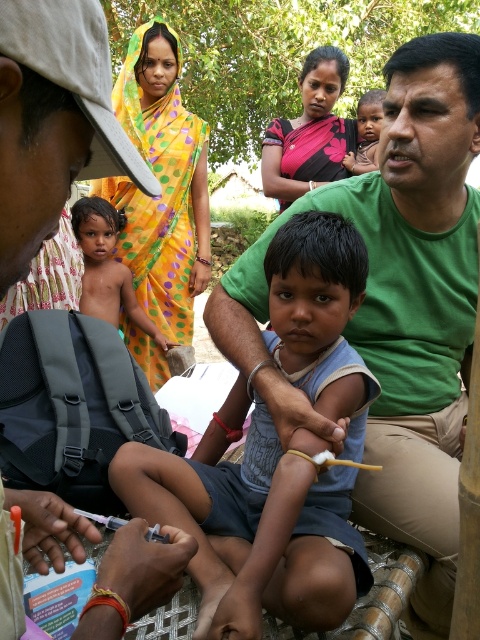
You are a healthcare worker observing a vaccination scene. You notice the light blue fabric shirt at center and the matte skin child at center. Which object is wider?

The light blue fabric shirt at center is wider than the matte skin child at center.

You are standing in the scene and want to move from point A to point B. Point A is located at coordinates point (156, 596) and point B is at point (351, 164). Which point is closer to you?

Point (156, 596) is closer to you than point (351, 164).

You are a photographer trying to capture a closeup of the shiny skin child at center without the yellow dotted sari at upper left blocking the view. Given their sizes, can you frame the shot so the child is fully visible without the sari overlapping?

The yellow dotted sari at upper left is wider than the shiny skin child at center, so it might block part of the child in the frame. Adjust the camera angle or zoom in to focus solely on the child to avoid the sari overlapping.